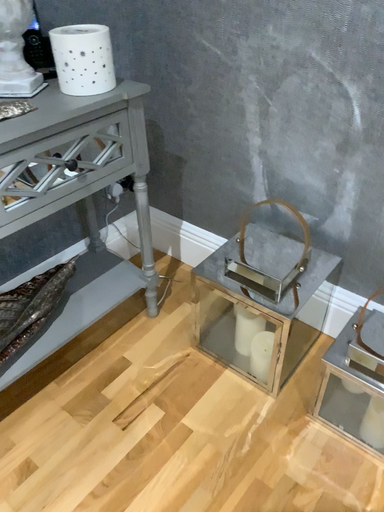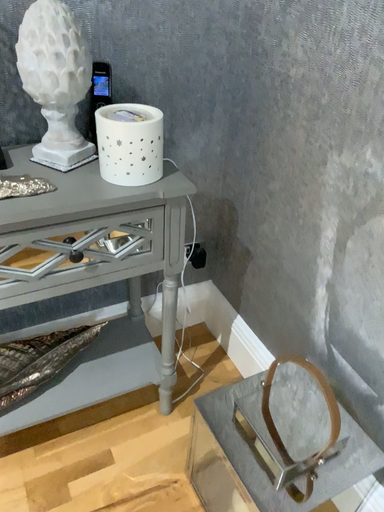
Question: How did the camera likely rotate when shooting the video?

Choices:
 (A) rotated right
 (B) rotated left

Answer: (B)